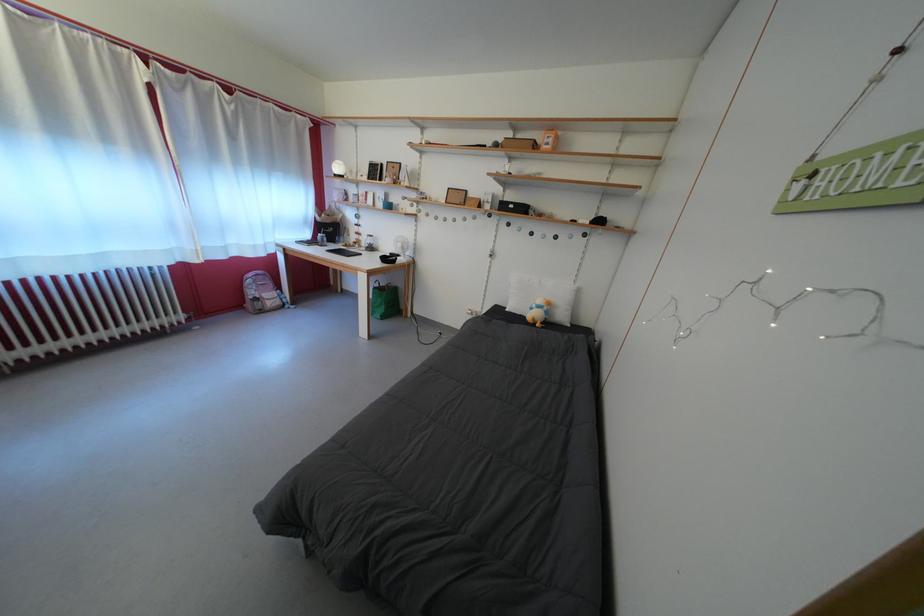
Find where to lift the small black box. Please return your answer as a coordinate pair (x, y).

(513, 207)